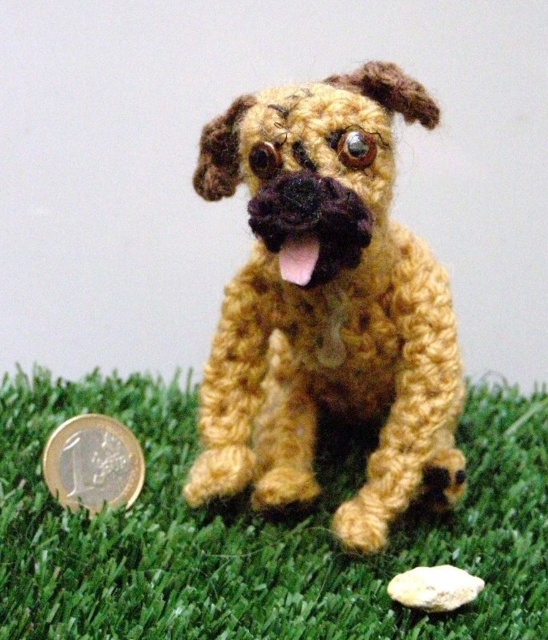
You are a small insect that wants to climb from the green yarn grass at lower center to the yarn crocheted dog at center. Is the path possible?

The green yarn grass at lower center is located below the yarn crocheted dog at center, so the insect can climb up from the green yarn grass at lower center to the yarn crocheted dog at center.

You are a small insect and want to cross from the gold metallic coin at lower left to the green yarn grass at lower center. Can you fit through the space between them?

The green yarn grass at lower center is wider than the gold metallic coin at lower left, so yes, the insect can fit through the space between them as the grass is wider, providing enough space.